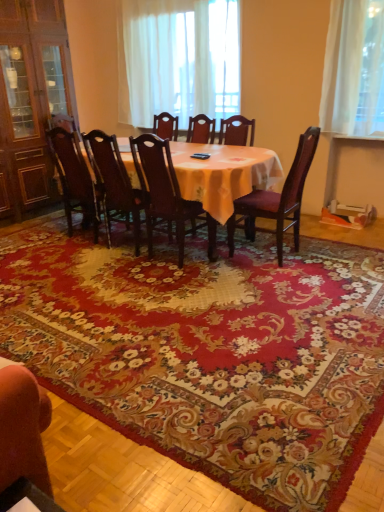
Question: Is wooden chair at center, arranged as the second chair when viewed from the right, positioned with its back to white sheer curtain at upper center?

Choices:
 (A) no
 (B) yes

Answer: (A)

Question: Can you confirm if wooden chair at center, arranged as the second chair when viewed from the right, is bigger than white sheer curtain at upper center?

Choices:
 (A) no
 (B) yes

Answer: (A)

Question: Considering the relative positions of wooden chair at center, the fourth chair from the left, and white sheer curtain at upper center in the image provided, is wooden chair at center, the fourth chair from the left, to the right of white sheer curtain at upper center from the viewer's perspective?

Choices:
 (A) no
 (B) yes

Answer: (B)

Question: Is wooden chair at center, the fourth chair from the left, wider than white sheer curtain at upper center?

Choices:
 (A) no
 (B) yes

Answer: (B)

Question: Is wooden chair at center, arranged as the second chair when viewed from the right, shorter than white sheer curtain at upper center?

Choices:
 (A) yes
 (B) no

Answer: (A)

Question: Based on their positions, is dark wood chair at center, the 2th chair when ordered from left to right, located to the left or right of wooden chair with purple cushion at right, the fifth chair when ordered from left to right?

Choices:
 (A) left
 (B) right

Answer: (A)

Question: From the image's perspective, is dark wood chair at center, which is the fourth chair in right-to-left order, located above or below wooden chair with purple cushion at right, placed as the 1th chair when sorted from right to left?

Choices:
 (A) below
 (B) above

Answer: (B)

Question: Which is correct: dark wood chair at center, which is the fourth chair in right-to-left order, is inside wooden chair with purple cushion at right, placed as the 1th chair when sorted from right to left, or outside of it?

Choices:
 (A) inside
 (B) outside

Answer: (B)

Question: In terms of size, does dark wood chair at center, which is the fourth chair in right-to-left order, appear bigger or smaller than wooden chair with purple cushion at right, the fifth chair when ordered from left to right?

Choices:
 (A) big
 (B) small

Answer: (B)

Question: From their relative heights in the image, would you say wooden chair with purple cushion at right, the fifth chair when ordered from left to right, is taller or shorter than dark wood chair at center, the 2th chair when ordered from left to right?

Choices:
 (A) tall
 (B) short

Answer: (A)

Question: Looking at their shapes, would you say wooden chair with purple cushion at right, placed as the 1th chair when sorted from right to left, is wider or thinner than dark wood chair at center, the 2th chair when ordered from left to right?

Choices:
 (A) wide
 (B) thin

Answer: (A)

Question: Considering the relative positions of wooden chair with purple cushion at right, the fifth chair when ordered from left to right, and dark wood chair at center, the 2th chair when ordered from left to right, in the image provided, is wooden chair with purple cushion at right, the fifth chair when ordered from left to right, to the left or to the right of dark wood chair at center, the 2th chair when ordered from left to right,?

Choices:
 (A) right
 (B) left

Answer: (A)

Question: Looking at the image, does wooden chair with purple cushion at right, the fifth chair when ordered from left to right, seem bigger or smaller compared to dark wood chair at center, which is the fourth chair in right-to-left order?

Choices:
 (A) small
 (B) big

Answer: (B)

Question: Visually, is wooden chair at center, the third chair from the left, positioned to the left or to the right of dark wood chair at center, which is the fourth chair in right-to-left order?

Choices:
 (A) left
 (B) right

Answer: (B)

Question: Considering the positions of point (152, 214) and point (127, 204), is point (152, 214) closer or farther from the camera than point (127, 204)?

Choices:
 (A) closer
 (B) farther

Answer: (A)